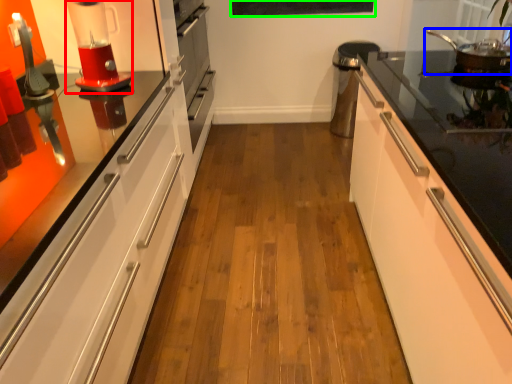
Question: Considering the real-world distances, which object is farthest from home appliance (highlighted by a red box)? kitchen appliance (highlighted by a blue box) or bulletin board (highlighted by a green box)?

Choices:
 (A) kitchen appliance
 (B) bulletin board

Answer: (B)